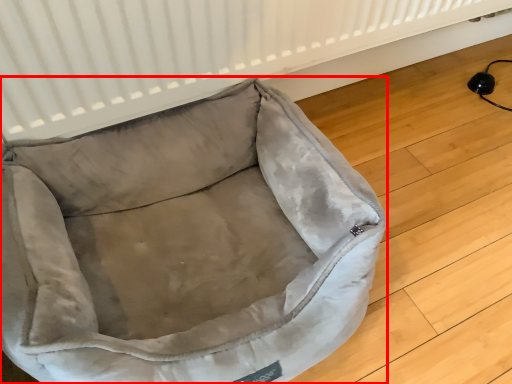
Question: From the image, what is the correct spatial relationship of dog bed (annotated by the red box) in relation to radiator?

Choices:
 (A) right
 (B) left

Answer: (B)